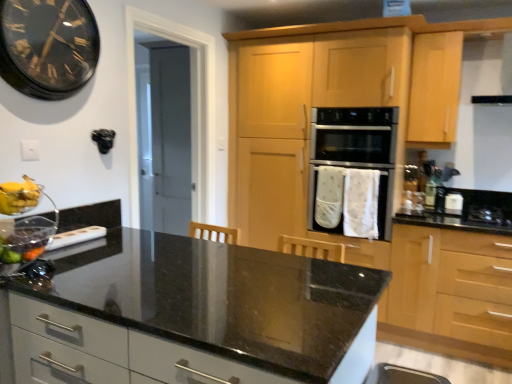
Question: Is point (17, 185) positioned closer to the camera than point (331, 132)?

Choices:
 (A) closer
 (B) farther

Answer: (A)

Question: Looking at the image, does transparent glass bowl at lower left seem bigger or smaller compared to white fabric oven at center?

Choices:
 (A) small
 (B) big

Answer: (A)

Question: Estimate the real-world distances between objects in this image. Which object is farther from the transparent glass bowl at lower left?

Choices:
 (A) yellow matte banana at left
 (B) black glass gas stove at right
 (C) black matte exhaust hood at upper right
 (D) shiny plastic grapes at left
 (E) light wood/texture cabinet at right, arranged as the 1th cabinetry when viewed from the right

Answer: (C)

Question: Based on their relative distances, which object is nearer to the white fabric oven at center?

Choices:
 (A) black granite countertop at center
 (B) light wood cabinetry at center, the 1th cabinetry when ordered from left to right
 (C) transparent glass bowl at lower left
 (D) black glass clock at upper left
 (E) yellow matte banana at left

Answer: (B)